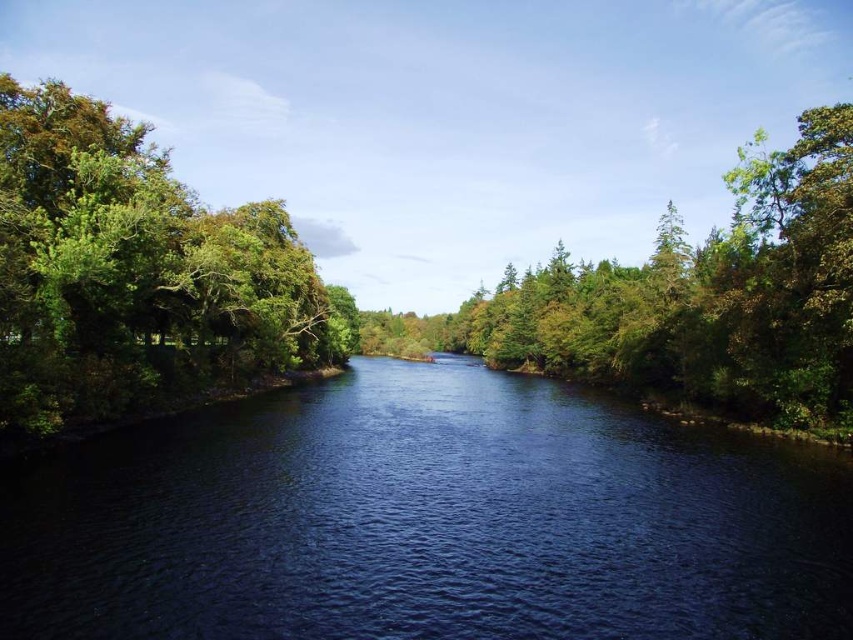
Question: Among these points, which one is farthest from the camera?

Choices:
 (A) (805, 280)
 (B) (486, 620)
 (C) (9, 188)

Answer: (A)

Question: Is deep blue water at center above green leafy tree at left?

Choices:
 (A) yes
 (B) no

Answer: (B)

Question: Can you confirm if green leafy forest at center is positioned to the left of green leafy tree at left?

Choices:
 (A) yes
 (B) no

Answer: (B)

Question: Which point is farther to the camera?

Choices:
 (A) (36, 364)
 (B) (241, 637)
 (C) (161, 243)

Answer: (C)

Question: In this image, where is green leafy forest at center located relative to green leafy tree at left?

Choices:
 (A) below
 (B) above

Answer: (B)

Question: Which point is closer to the camera?

Choices:
 (A) (395, 566)
 (B) (260, 230)

Answer: (A)